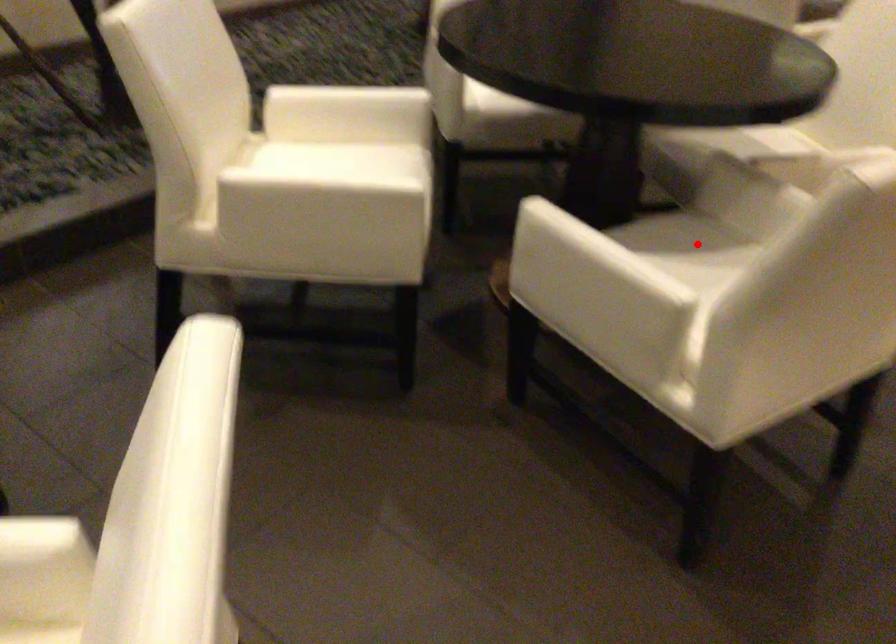
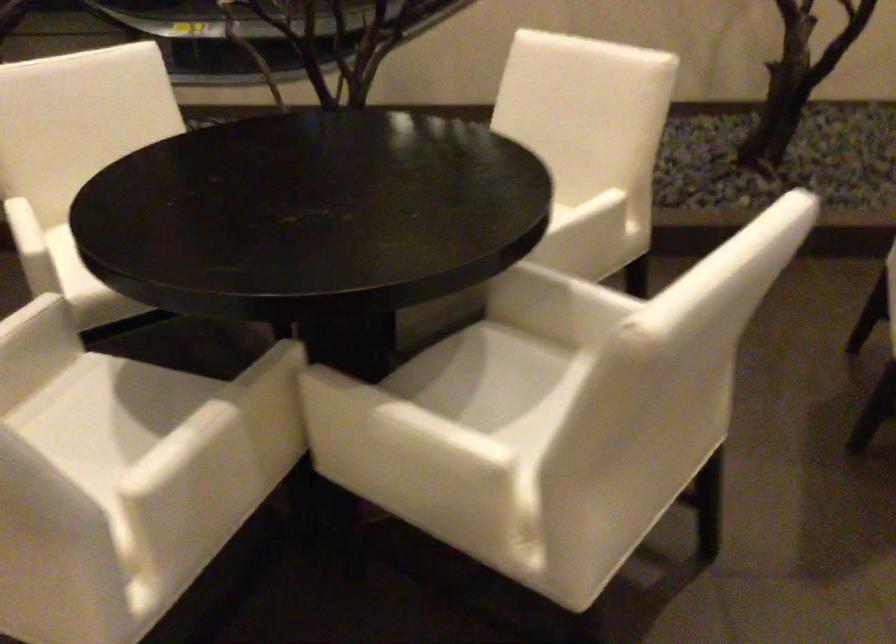
Question: A red point is marked in image1. In image2, is the corresponding 3D point closer to the camera or farther? Reply with the corresponding letter.

Choices:
 (A) The corresponding 3D point is closer.
 (B) The corresponding 3D point is farther.

Answer: (A)